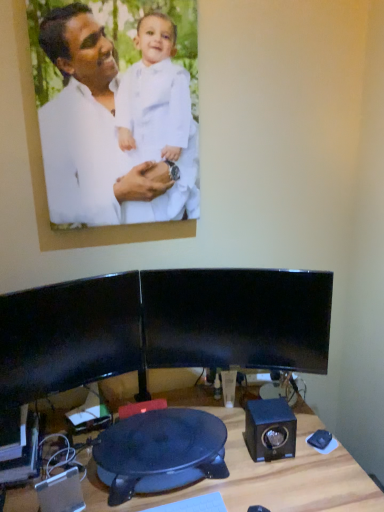
Where is `vacant area that lies between blue matte speaker at lower right, which appears as the 2th speaker when viewed from the front, and black plastic keyboard at lower center`? This screenshot has width=384, height=512. vacant area that lies between blue matte speaker at lower right, which appears as the 2th speaker when viewed from the front, and black plastic keyboard at lower center is located at coordinates (227, 481).